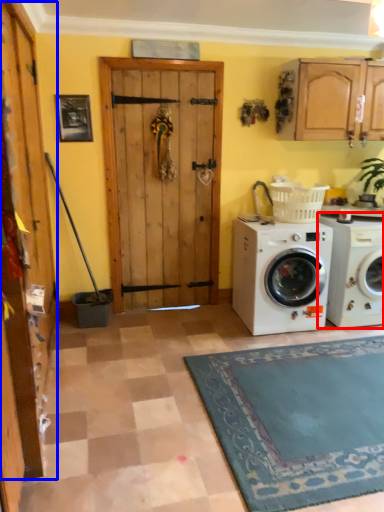
Question: Which object appears closest to the camera in this image, washing machine (highlighted by a red box) or barn door (highlighted by a blue box)?

Choices:
 (A) washing machine
 (B) barn door

Answer: (B)